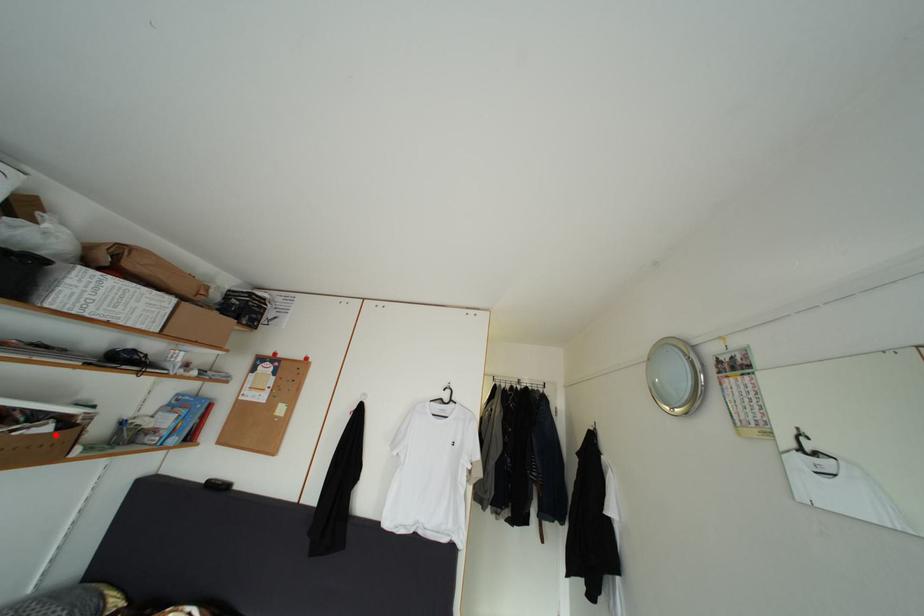
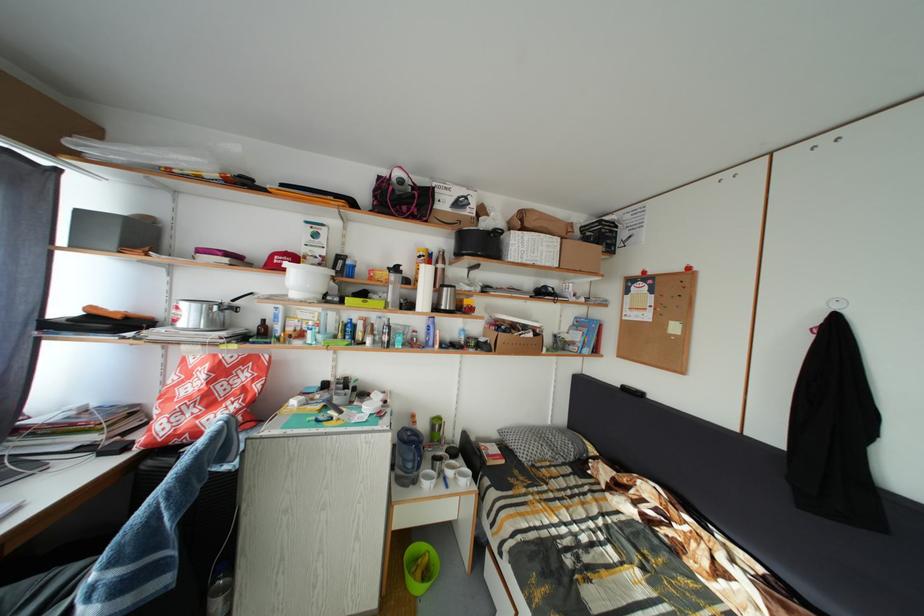
Where in the second image is the point corresponding to the highlighted location from the first image?

(540, 341)